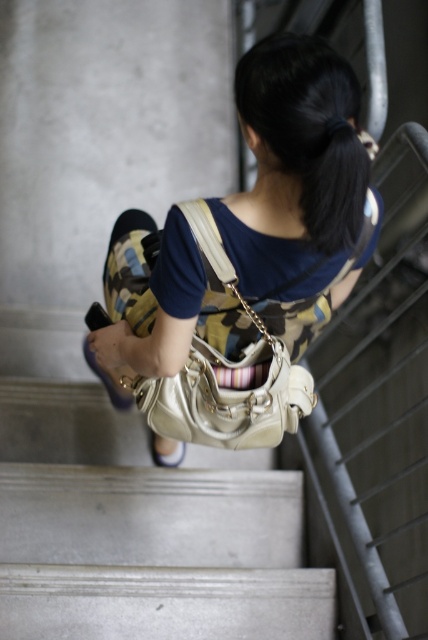
You are a photographer trying to capture the perfect shot of the matte beige purse at center and the white fabric sandal at lower center. Based on their positions, which object should you focus on first to ensure both are in frame without moving the camera?

The matte beige purse at center is to the right of the white fabric sandal at lower center, so focusing on the white fabric sandal at lower center first would allow the matte beige purse at center to naturally fall into the frame to its right without needing to adjust the camera position.